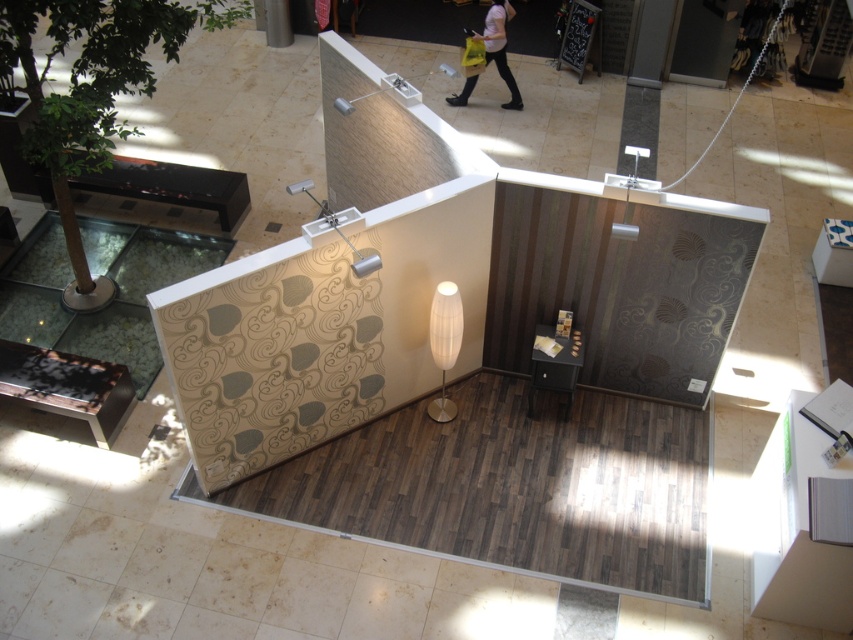
Question: Does wooden laminate floor at center have a larger size compared to matte pink shirt at upper center?

Choices:
 (A) yes
 (B) no

Answer: (A)

Question: Among these points, which one is nearest to the camera?

Choices:
 (A) (503, 56)
 (B) (236, 486)

Answer: (B)

Question: Where is wooden laminate floor at center located in relation to matte pink shirt at upper center in the image?

Choices:
 (A) right
 (B) left

Answer: (B)

Question: Can you confirm if wooden laminate floor at center is smaller than matte pink shirt at upper center?

Choices:
 (A) no
 (B) yes

Answer: (A)

Question: Which point is closer to the camera taking this photo?

Choices:
 (A) click(x=457, y=102)
 (B) click(x=704, y=429)

Answer: (B)